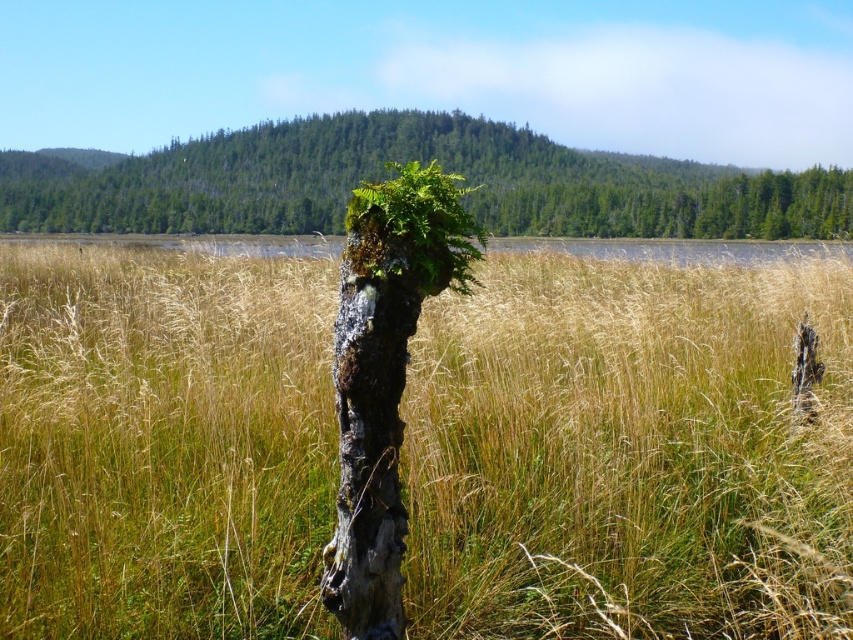
You are standing at the point marked by coordinates point (628, 452) in the image. What is the nearest object to you in the scene?

The nearest object to you at point (628, 452) is the brown grassy area at center, as you are standing directly on it.

From the picture: You are a gardener who wants to plant a new fern next to the green mossy stump at center and the green mossy fern at center. Based on their positions, which direction should you move from the stump to place the new fern?

The green mossy stump at center is positioned on the left side of the green mossy fern at center, so to plant the new fern next to them, you should move to the right side of the stump.